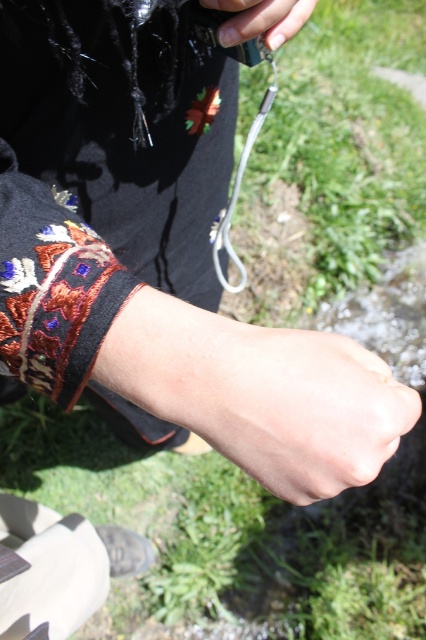
Question: Which point is farther to the camera?

Choices:
 (A) dry skin at center
 (B) nail polish at center

Answer: (B)

Question: Is dry skin at center smaller than nail polish at center?

Choices:
 (A) yes
 (B) no

Answer: (B)

Question: Can you confirm if dry skin at center is positioned above nail polish at center?

Choices:
 (A) yes
 (B) no

Answer: (B)

Question: Does dry skin at center appear on the right side of nail polish at center?

Choices:
 (A) no
 (B) yes

Answer: (B)